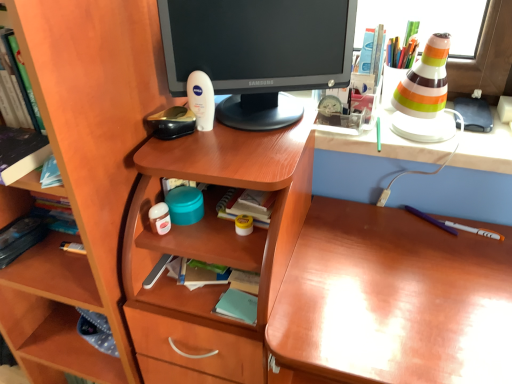
Locate an element on the screen. This screenshot has height=384, width=512. hardcover book at left, the 2th book from the bottom is located at coordinates (20, 238).

What is the approximate width of hardcover book at left, which appears as the 2th book when viewed from the top?

It is 8.47 inches.

Where is `wooden shelf at left`? wooden shelf at left is located at coordinates (83, 176).

What is the approximate height of wooden shelf at left?

It is 4.08 feet.

The image size is (512, 384). Describe the element at coordinates (391, 301) in the screenshot. I see `glossy wood desk at center` at that location.

The image size is (512, 384). What do you see at coordinates (237, 306) in the screenshot?
I see `light blue paper at center, which is the first book in bottom-to-top order` at bounding box center [237, 306].

Describe the element at coordinates (258, 53) in the screenshot. I see `matte black monitor at center` at that location.

What is the approximate height of wooden at left?

wooden at left is 3.31 feet tall.

I want to click on hardcover book at left, the 2th book viewed from the left, so click(x=21, y=153).

Which is in front, matte black monitor at center or white glossy cone at upper right?

matte black monitor at center is closer to the camera.

Is matte black monitor at center wider or thinner than white glossy cone at upper right?

matte black monitor at center is thinner than white glossy cone at upper right.

Is matte black monitor at center facing away from white glossy cone at upper right?

matte black monitor at center is not turned away from white glossy cone at upper right.

How different are the orientations of matte black monitor at center and white glossy cone at upper right in degrees?

24.1 degrees separate the facing orientations of matte black monitor at center and white glossy cone at upper right.

From the image's perspective, is white glossy cone at upper right below wooden at left?

No.

From a real-world perspective, who is located lower, white glossy cone at upper right or wooden at left?

In real-world perspective, wooden at left is lower.

The width and height of the screenshot is (512, 384). Identify the location of table lying on the left of white glossy cone at upper right. (214, 250).

Can wooden at left be found inside white glossy cone at upper right?

That's incorrect, wooden at left is not inside white glossy cone at upper right.

Considering the sizes of objects wooden shelf at left and hardcover book at left, arranged as the second book when viewed from the right, in the image provided, who is thinner, wooden shelf at left or hardcover book at left, arranged as the second book when viewed from the right,?

Thinner between the two is hardcover book at left, arranged as the second book when viewed from the right.

From a real-world perspective, is wooden shelf at left positioned over hardcover book at left, arranged as the second book when viewed from the right, based on gravity?

No, from a real-world perspective, wooden shelf at left is not above hardcover book at left, arranged as the second book when viewed from the right.

From the image's perspective, is wooden shelf at left under hardcover book at left, the first book in the top-to-bottom sequence?

Yes, from the image's perspective, wooden shelf at left is beneath hardcover book at left, the first book in the top-to-bottom sequence.

Is wooden shelf at left placed right next to hardcover book at left, arranged as the second book when viewed from the right?

No, wooden shelf at left is not making contact with hardcover book at left, arranged as the second book when viewed from the right.

Who is smaller, wooden shelf at left or light blue paper at center, the second book in the back-to-front sequence?

With smaller size is light blue paper at center, the second book in the back-to-front sequence.

Is point (139, 138) closer or farther from the camera than point (251, 300)?

Point (139, 138) appears to be farther away from the viewer than point (251, 300).

Which object is further away from the camera, wooden shelf at left or light blue paper at center, positioned as the second book in front-to-back order?

light blue paper at center, positioned as the second book in front-to-back order, is more distant.

Considering the sizes of objects wooden shelf at left and light blue paper at center, the third book positioned from the top, in the image provided, who is taller, wooden shelf at left or light blue paper at center, the third book positioned from the top,?

Answer: wooden shelf at left.

Is point (46, 229) positioned before point (30, 150)?

No, (46, 229) is behind (30, 150).

From a real-world perspective, is hardcover book at left, the 2th book from the bottom, below hardcover book at left, arranged as the second book when viewed from the right?

Yes, from a real-world perspective, hardcover book at left, the 2th book from the bottom, is under hardcover book at left, arranged as the second book when viewed from the right.

Is there a large distance between hardcover book at left, the 2th book from the bottom, and hardcover book at left, which is the third book from back to front?

hardcover book at left, the 2th book from the bottom, is actually quite close to hardcover book at left, which is the third book from back to front.

Can you confirm if hardcover book at left, which is the 1th book from back to front, is thinner than hardcover book at left, which is the third book in bottom-to-top order?

No.

Is point (325, 15) in front of point (11, 136)?

No, it is not.

Could hardcover book at left, which is the third book in bottom-to-top order, be considered to be inside matte black monitor at center?

No, matte black monitor at center does not contain hardcover book at left, which is the third book in bottom-to-top order.

Identify the location of computer monitor that appears behind the hardcover book at left, which is the third book from back to front. (258, 53).

In terms of size, does hardcover book at left, arranged as the second book when viewed from the right, appear bigger or smaller than hardcover book at left, the third book from the right?

In the image, hardcover book at left, arranged as the second book when viewed from the right, appears to be larger than hardcover book at left, the third book from the right.

Could you measure the distance between hardcover book at left, which is the third book from back to front, and hardcover book at left, the third book from the right?

They are 13.02 inches apart.

Is hardcover book at left, which is the third book from back to front, facing away from hardcover book at left, placed as the 1th book when sorted from left to right?

That's not correct — hardcover book at left, which is the third book from back to front, is not looking away from hardcover book at left, placed as the 1th book when sorted from left to right.

Which object is further away from the camera, hardcover book at left, which is the third book in bottom-to-top order, or hardcover book at left, the 2th book from the bottom?

hardcover book at left, the 2th book from the bottom, is further from the camera.

Where is `computer on the right of matte black monitor at center`? The image size is (512, 384). computer on the right of matte black monitor at center is located at coordinates (386, 144).

The height and width of the screenshot is (384, 512). In order to click on table below the white glossy cone at upper right (from the image's perspective) in this screenshot , I will do 214,250.

From the image, which object appears to be nearer to hardcover book at left, the 1th book in the front-to-back sequence, white glossy cone at upper right or glossy wood desk at center?

glossy wood desk at center lies closer to hardcover book at left, the 1th book in the front-to-back sequence, than the other object.

In the scene shown: When comparing their distances from wooden shelf at left, does light blue paper at center, positioned as the second book in front-to-back order, or wooden at left seem further?

light blue paper at center, positioned as the second book in front-to-back order.

From the picture: Estimate the real-world distances between objects in this image. Which object is closer to matte black monitor at center, glossy wood desk at center or light blue paper at center, the third book positioned from the top?

glossy wood desk at center is closer to matte black monitor at center.

Based on the photo, from the image, which object appears to be nearer to glossy wood desk at center, white glossy cone at upper right or light blue paper at center, the first book positioned from the right?

Among the two, white glossy cone at upper right is located nearer to glossy wood desk at center.

Estimate the real-world distances between objects in this image. Which object is further from wooden shelf at left, light blue paper at center, the third book positioned from the top, or hardcover book at left, arranged as the second book when viewed from the right?

The object further to wooden shelf at left is light blue paper at center, the third book positioned from the top.

From the image, which object appears to be farther from hardcover book at left, which is the third book from back to front, wooden shelf at left or wooden at left?

Based on the image, wooden at left appears to be further to hardcover book at left, which is the third book from back to front.

Estimate the real-world distances between objects in this image. Which object is closer to hardcover book at left, the first book in the top-to-bottom sequence, hardcover book at left, placed as the 1th book when sorted from left to right, or light blue paper at center, the third book positioned from the top?

hardcover book at left, placed as the 1th book when sorted from left to right.

Based on their spatial positions, is matte black monitor at center or wooden shelf at left further from hardcover book at left, the first book in the top-to-bottom sequence?

matte black monitor at center is positioned further to the anchor hardcover book at left, the first book in the top-to-bottom sequence.

Where is `computer monitor situated between hardcover book at left, placed as the 1th book when sorted from left to right, and white glossy cone at upper right from left to right`? The image size is (512, 384). computer monitor situated between hardcover book at left, placed as the 1th book when sorted from left to right, and white glossy cone at upper right from left to right is located at coordinates (258, 53).

Identify the location of book between hardcover book at left, the third book from the right, and light blue paper at center, the first book positioned from the right, from left to right. (21, 153).

Locate an element on the screen. This screenshot has width=512, height=384. shelf between hardcover book at left, acting as the 3th book starting from the front, and glossy wood desk at center from left to right is located at coordinates (83, 176).

Locate an element on the screen. table between hardcover book at left, placed as the 1th book when sorted from left to right, and matte black monitor at center is located at coordinates (214, 250).